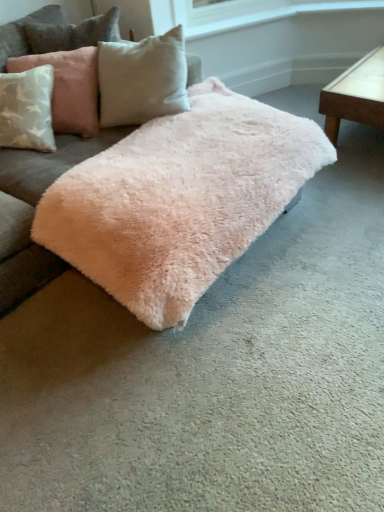
Describe the element at coordinates (355, 95) in the screenshot. I see `light brown wooden table at right` at that location.

This screenshot has height=512, width=384. I want to click on fuzzy pink rug at center, so click(33, 210).

Identify the location of studio couch located underneath the light pink plush pillow at upper left (from a real-world perspective). The width and height of the screenshot is (384, 512). (33, 210).

Between fuzzy pink rug at center and light pink plush pillow at upper left, which one appears on the left side from the viewer's perspective?

light pink plush pillow at upper left is more to the left.

Does fuzzy pink rug at center have a greater height compared to light pink plush pillow at upper left?

Correct, fuzzy pink rug at center is much taller as light pink plush pillow at upper left.

What's the angular difference between fuzzy pink rug at center and light pink plush pillow at upper left's facing directions?

fuzzy pink rug at center and light pink plush pillow at upper left are facing 25.1 degrees away from each other.

The image size is (384, 512). What are the coordinates of `table to the right of fuzzy pink rug at center` in the screenshot? It's located at (355, 95).

Considering the sizes of objects light brown wooden table at right and fuzzy pink rug at center in the image provided, who is smaller, light brown wooden table at right or fuzzy pink rug at center?

light brown wooden table at right is smaller.

Considering the sizes of light brown wooden table at right and fuzzy pink rug at center in the image, is light brown wooden table at right wider or thinner than fuzzy pink rug at center?

light brown wooden table at right is wider than fuzzy pink rug at center.

Is light brown wooden table at right positioned beyond the bounds of fuzzy pink rug at center?

Yes, light brown wooden table at right is located beyond the bounds of fuzzy pink rug at center.

Which object is positioned more to the right, fuzzy pink rug at center or light brown wooden table at right?

light brown wooden table at right.

Based on the photo, is fuzzy pink rug at center looking in the opposite direction of light brown wooden table at right?

No, fuzzy pink rug at center is not facing away from light brown wooden table at right.

Can you confirm if fuzzy pink rug at center is thinner than light brown wooden table at right?

Yes, fuzzy pink rug at center is thinner than light brown wooden table at right.

From the image's perspective, which object appears higher, fuzzy pink rug at center or light brown wooden table at right?

light brown wooden table at right appears higher in the image.

Considering the sizes of objects light brown wooden table at right and light pink plush pillow at upper left in the image provided, who is shorter, light brown wooden table at right or light pink plush pillow at upper left?

With less height is light brown wooden table at right.

From a real-world perspective, is light brown wooden table at right located beneath light pink plush pillow at upper left?

Yes, from a real-world perspective, light brown wooden table at right is below light pink plush pillow at upper left.

Considering the sizes of light brown wooden table at right and light pink plush pillow at upper left in the image, is light brown wooden table at right bigger or smaller than light pink plush pillow at upper left?

In the image, light brown wooden table at right appears to be larger than light pink plush pillow at upper left.

Which point is more distant from viewer, (376, 66) or (52, 119)?

Positioned behind is point (376, 66).

In the image, is light pink plush pillow at upper left on the left side or the right side of light brown wooden table at right?

From the image, it's evident that light pink plush pillow at upper left is to the left of light brown wooden table at right.

Which of these two, light pink plush pillow at upper left or light brown wooden table at right, stands shorter?

Standing shorter between the two is light brown wooden table at right.

Does light pink plush pillow at upper left come in front of light brown wooden table at right?

Yes, the depth of light pink plush pillow at upper left is less than that of light brown wooden table at right.

In terms of width, does light pink plush pillow at upper left look wider or thinner when compared to light brown wooden table at right?

In the image, light pink plush pillow at upper left appears to be more narrow than light brown wooden table at right.

Considering the points (64, 83) and (10, 236), which point is in front, point (64, 83) or point (10, 236)?

The point (10, 236) is more forward.

Find the location of a particular element. The image size is (384, 512). studio couch below the light pink plush pillow at upper left (from the image's perspective) is located at coordinates (33, 210).

From a real-world perspective, which is physically above, light pink plush pillow at upper left or fuzzy pink rug at center?

In real-world perspective, light pink plush pillow at upper left is above.

Considering the positions of objects light pink plush pillow at upper left and fuzzy pink rug at center in the image provided, who is behind, light pink plush pillow at upper left or fuzzy pink rug at center?

light pink plush pillow at upper left is more distant.

I want to click on studio couch in front of the light pink plush pillow at upper left, so click(33, 210).

Locate an element on the screen. table on the right of fuzzy pink rug at center is located at coordinates (355, 95).

Which object lies further to the anchor point light brown wooden table at right, fuzzy pink rug at center or light pink plush pillow at upper left?

light pink plush pillow at upper left is positioned further to the anchor light brown wooden table at right.

When comparing their distances from fuzzy pink rug at center, does light brown wooden table at right or light pink plush pillow at upper left seem further?

light brown wooden table at right.

Based on their spatial positions, is light brown wooden table at right or fuzzy pink rug at center closer to light pink plush pillow at upper left?

fuzzy pink rug at center.

When comparing their distances from light pink plush pillow at upper left, does fuzzy pink rug at center or light brown wooden table at right seem further?

light brown wooden table at right.

Considering their positions, is light pink plush pillow at upper left positioned further to light brown wooden table at right than fuzzy pink rug at center?

light pink plush pillow at upper left is positioned further to the anchor light brown wooden table at right.

From the picture: When comparing their distances from fuzzy pink rug at center, does light pink plush pillow at upper left or light brown wooden table at right seem closer?

Based on the image, light pink plush pillow at upper left appears to be nearer to fuzzy pink rug at center.

You are a GUI agent. You are given a task and a screenshot of the screen. Output one action in this format:
    pyautogui.click(x=<x>, y=<y>)
    Task: Click on the studio couch situated between light pink plush pillow at upper left and light brown wooden table at right from left to right
    Image resolution: width=384 pixels, height=512 pixels.
    Given the screenshot: What is the action you would take?
    pyautogui.click(x=33, y=210)